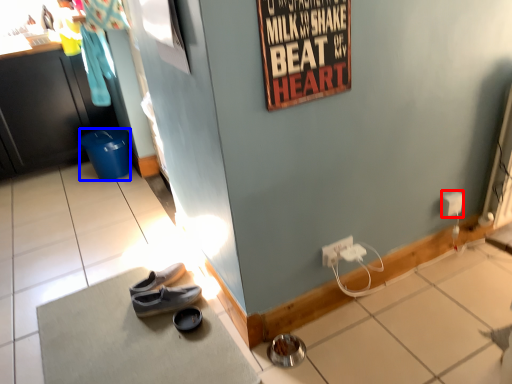
Question: Which object is further to the camera taking this photo, power outlet (highlighted by a red box) or trash bin/can (highlighted by a blue box)?

Choices:
 (A) power outlet
 (B) trash bin/can

Answer: (B)